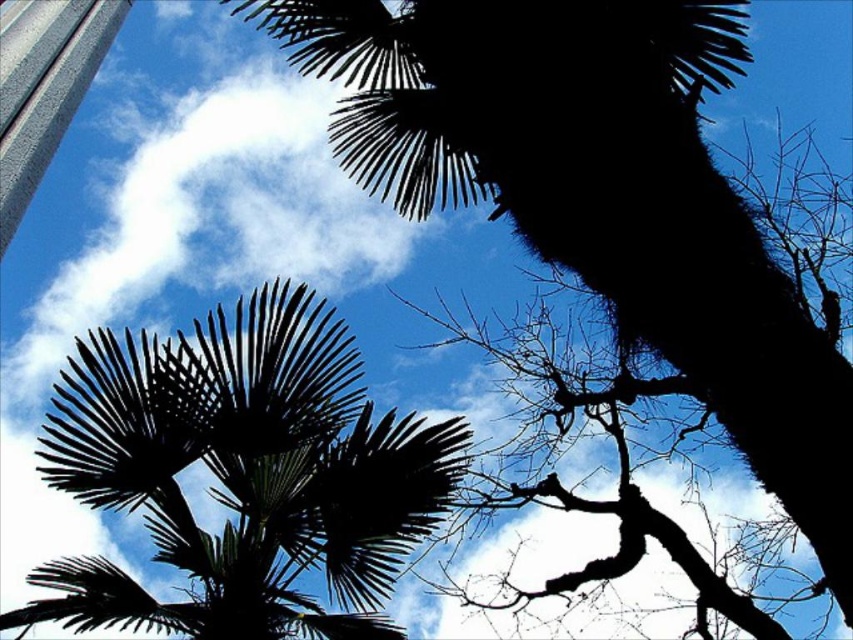
Question: Considering the relative positions of silhouette leafy branch at upper center and dark green leafy palm tree at center in the image provided, where is silhouette leafy branch at upper center located with respect to dark green leafy palm tree at center?

Choices:
 (A) below
 (B) above

Answer: (B)

Question: Which point is closer to the camera?

Choices:
 (A) (462, 166)
 (B) (175, 628)

Answer: (B)

Question: Observing the image, what is the correct spatial positioning of silhouette leafy branch at upper center in reference to dark green leafy palm tree at center?

Choices:
 (A) right
 (B) left

Answer: (A)

Question: Which point is farther to the camera?

Choices:
 (A) (770, 342)
 (B) (334, 385)

Answer: (B)

Question: From the image, what is the correct spatial relationship of silhouette leafy branch at upper center in relation to dark green leafy palm tree at center?

Choices:
 (A) right
 (B) left

Answer: (A)

Question: Which point appears farthest from the camera in this image?

Choices:
 (A) (305, 10)
 (B) (293, 540)

Answer: (A)